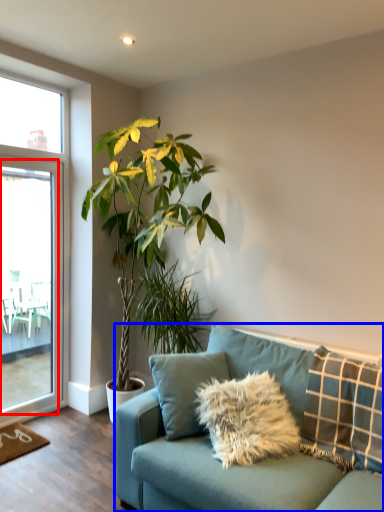
Question: Among these objects, which one is nearest to the camera, screen door (highlighted by a red box) or studio couch (highlighted by a blue box)?

Choices:
 (A) screen door
 (B) studio couch

Answer: (B)